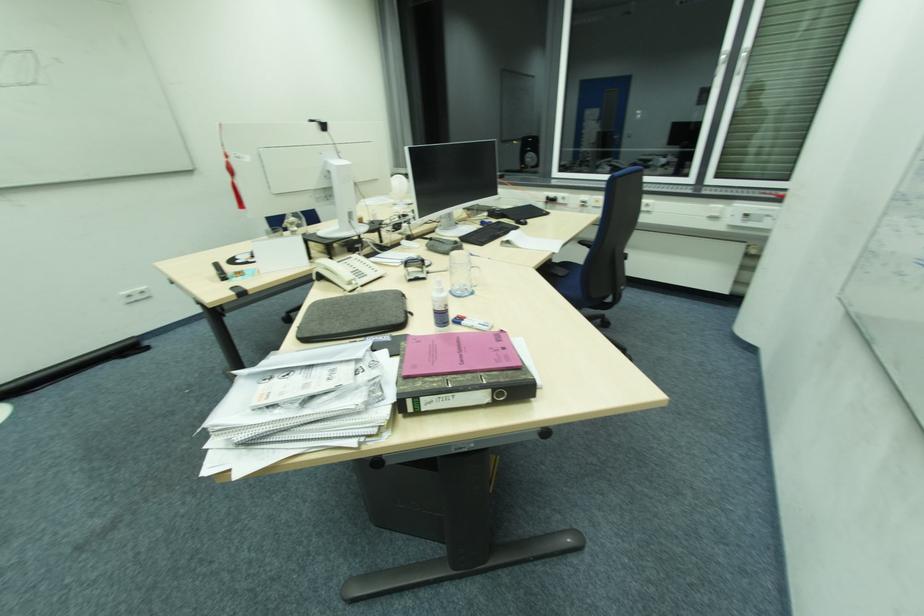
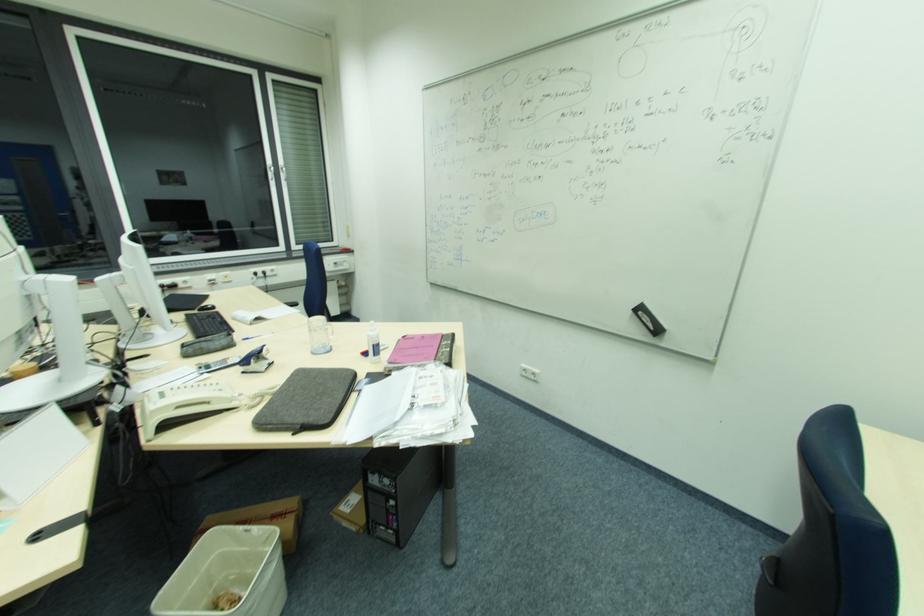
The point at [377,325] is marked in the first image. Where is the corresponding point in the second image?

(350, 382)